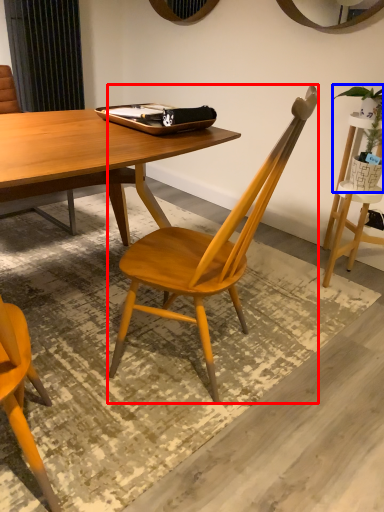
Question: Which object appears closest to the camera in this image, chair (highlighted by a red box) or houseplant (highlighted by a blue box)?

Choices:
 (A) chair
 (B) houseplant

Answer: (A)